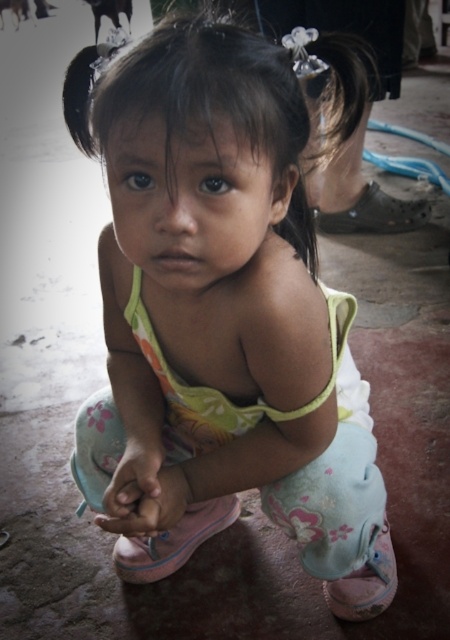
You are a photographer trying to capture a closeup of the pastel floral dress at center and the dark brown silky hair at center. Which object should you focus on first to ensure it appears sharp in the photo?

You should focus on the dark brown silky hair at center first because it is closer to the viewer than the pastel floral dress at center, so adjusting focus from near to far will help capture both sharply.

You are a tailor observing a child wearing a pastel floral dress at center and holding a light pink fabric hand at center. Which object takes up more space in the image?

The pastel floral dress at center is bigger than the light pink fabric hand at center, so it takes up more space in the image.